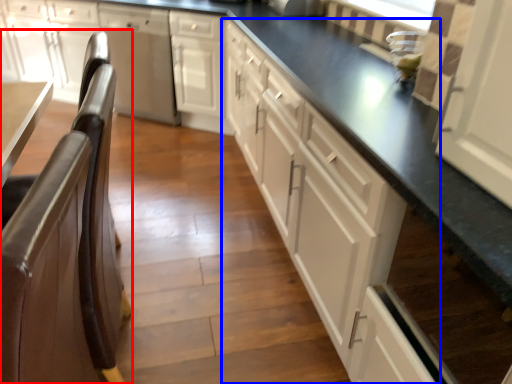
Question: Which point is further to the camera, chair (highlighted by a red box) or cabinetry (highlighted by a blue box)?

Choices:
 (A) chair
 (B) cabinetry

Answer: (A)